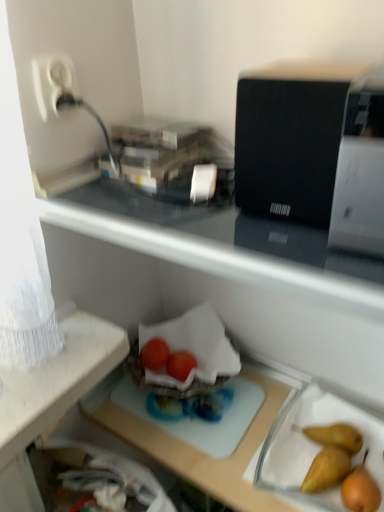
Identify the location of free space to the right of glossy plastic tomatoes at center, which is the first green vegetables in right-to-left order. (233, 392).